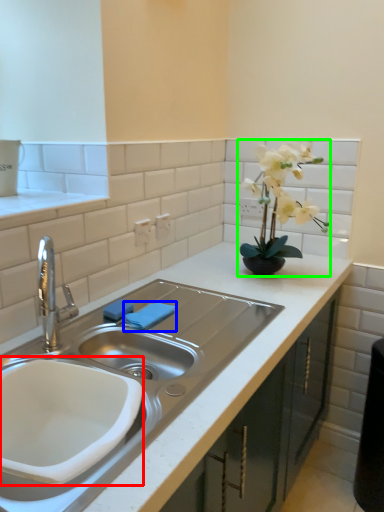
Question: Which object is the farthest from sink (highlighted by a red box)? Choose among these: towel bar (highlighted by a blue box) or houseplant (highlighted by a green box).

Choices:
 (A) towel bar
 (B) houseplant

Answer: (B)